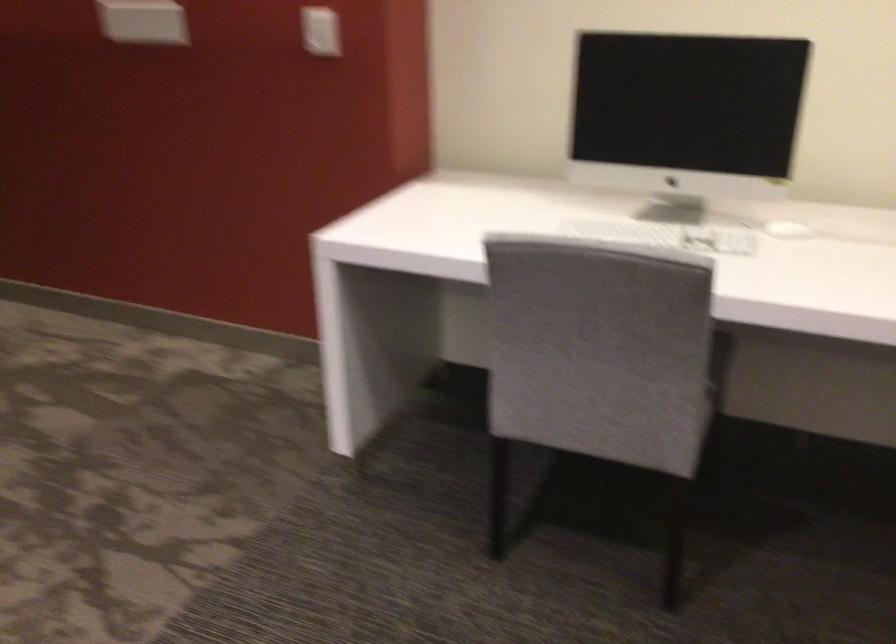
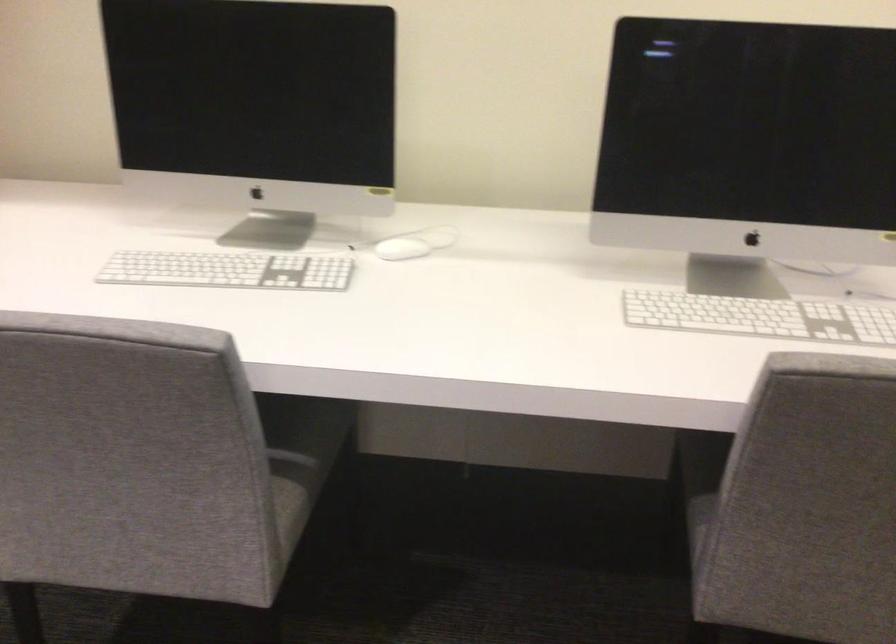
The point at (781, 223) is marked in the first image. Where is the corresponding point in the second image?

(401, 249)